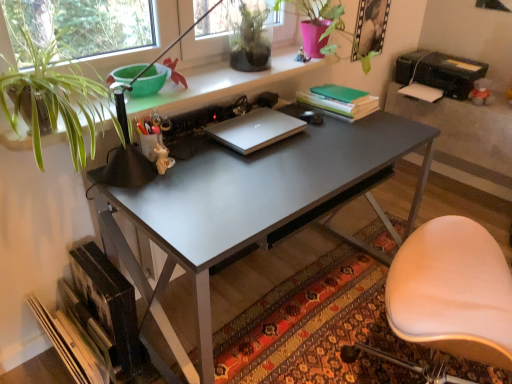
This screenshot has width=512, height=384. In order to click on free spot to the right of silver metallic laptop at center in this screenshot , I will do `click(324, 142)`.